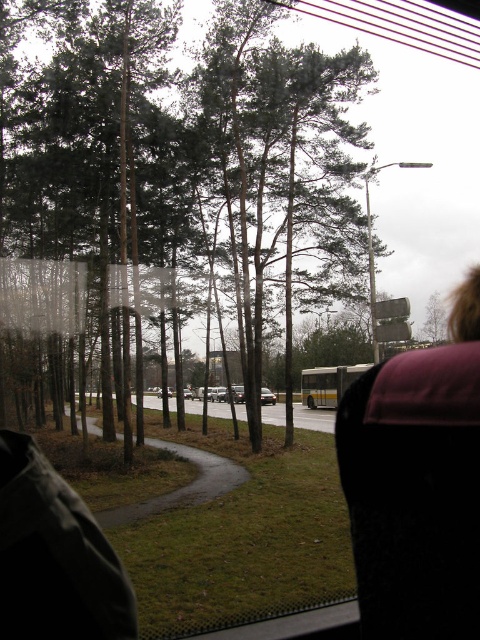
Looking at this image, you are sitting in the vehicle and want to know where the maroon fabric at upper right is located in the image. Please provide its coordinates based on the image grid system where the bottom left corner is the origin point.

The maroon fabric at upper right is located at coordinates point (x=417, y=483).

You are a passenger in the vehicle and looking out the window. You see a yellow metallic bus at center and a shiny silver sedan at center. Which vehicle is larger in size?

The yellow metallic bus at center is bigger than the shiny silver sedan at center, so the yellow metallic bus at center is larger in size.

You are inside a vehicle and looking out the window. You see two points marked on the road ahead. The first point is at coordinates point (307, 388) and the second is at point (264, 396). Which point is closer to your current position inside the vehicle?

Point (307, 388) is closer to the viewer than point (264, 396), so the first point is closer to your current position inside the vehicle.